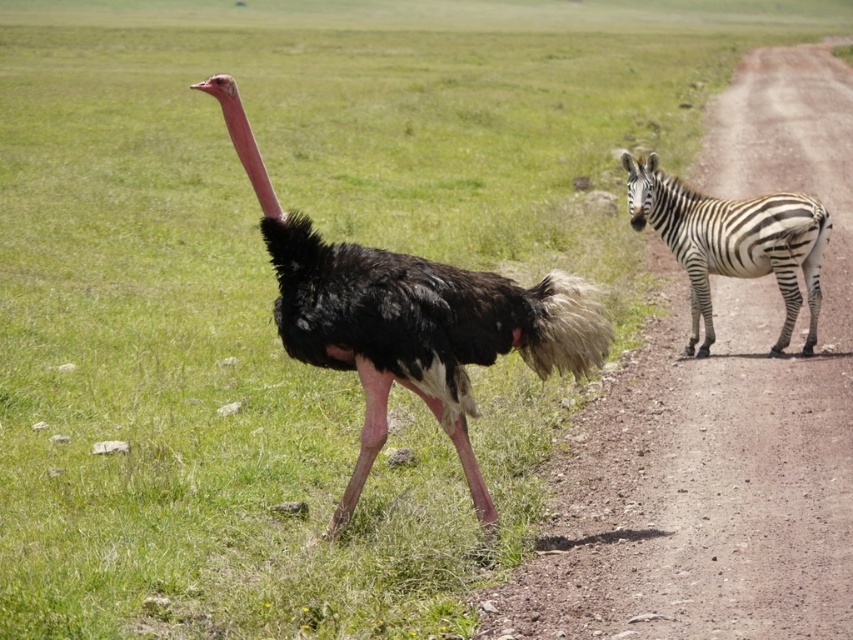
You are a wildlife photographer trying to capture a photo of both the black feathered ostrich at center and the black and white striped zebra at right. Which animal should you focus on first if you want to ensure the tallest animal is in the foreground?

The black feathered ostrich at center is taller than the black and white striped zebra at right, so you should focus on the black feathered ostrich at center first to ensure it appears in the foreground.

You are a photographer standing in the middle of the dirt path in the savanna. You see the dirttrack at right and the black and white stripes at right. Which object is positioned higher in the image?

The dirttrack at right is above the black and white stripes at right, so the dirttrack at right is positioned higher in the image.